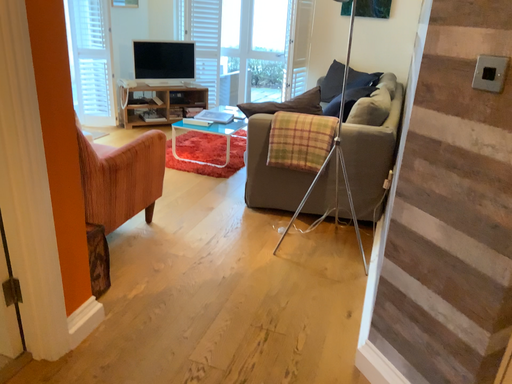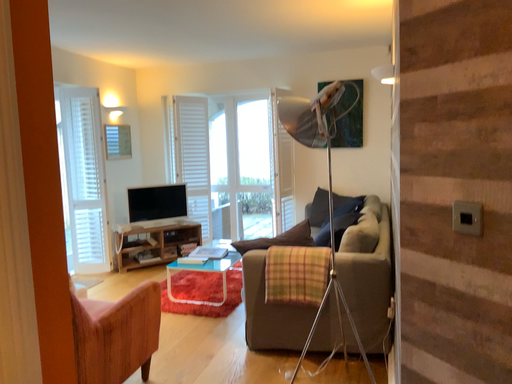
Question: Which way did the camera rotate in the video?

Choices:
 (A) rotated upward
 (B) rotated downward

Answer: (A)